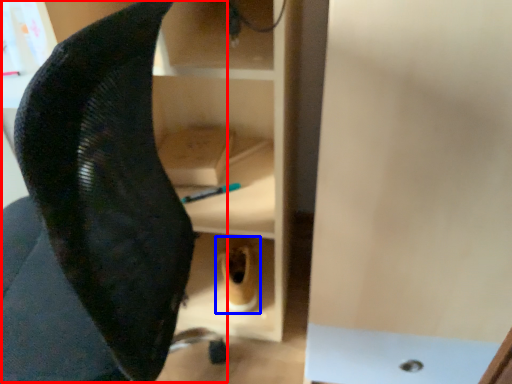
Question: Among these objects, which one is nearest to the camera, swivel chair (highlighted by a red box) or footwear (highlighted by a blue box)?

Choices:
 (A) swivel chair
 (B) footwear

Answer: (A)